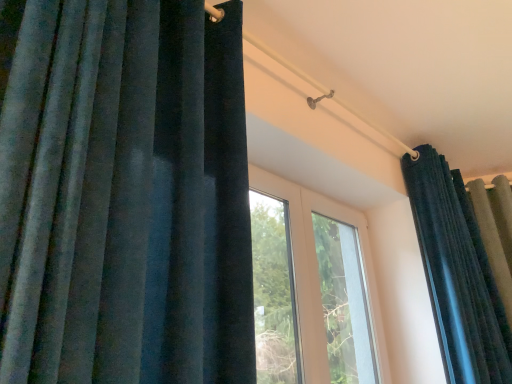
Question: From the image's perspective, is transparent glass window at center beneath velvet dark blue curtain at left, acting as the 1th curtain starting from the front?

Choices:
 (A) no
 (B) yes

Answer: (B)

Question: Is transparent glass window at center smaller than velvet dark blue curtain at left, acting as the 1th curtain starting from the front?

Choices:
 (A) yes
 (B) no

Answer: (A)

Question: Is transparent glass window at center oriented away from velvet dark blue curtain at left, arranged as the 2th curtain when viewed from the back?

Choices:
 (A) yes
 (B) no

Answer: (B)

Question: Can velvet dark blue curtain at left, acting as the 1th curtain starting from the front, be found inside transparent glass window at center?

Choices:
 (A) yes
 (B) no

Answer: (B)

Question: Would you consider transparent glass window at center to be distant from velvet dark blue curtain at left, acting as the 1th curtain starting from the front?

Choices:
 (A) yes
 (B) no

Answer: (A)

Question: Considering the relative positions of transparent glass window at center and velvet dark blue curtain at left, acting as the 1th curtain starting from the front, in the image provided, is transparent glass window at center to the left of velvet dark blue curtain at left, acting as the 1th curtain starting from the front, from the viewer's perspective?

Choices:
 (A) yes
 (B) no

Answer: (B)

Question: Would you say transparent glass window at center contains velvet dark blue curtain at upper right, which appears as the second curtain when viewed from the front?

Choices:
 (A) yes
 (B) no

Answer: (B)

Question: From a real-world perspective, is transparent glass window at center located beneath velvet dark blue curtain at upper right, the first curtain positioned from the back?

Choices:
 (A) yes
 (B) no

Answer: (A)

Question: From a real-world perspective, is transparent glass window at center located higher than velvet dark blue curtain at upper right, positioned as the 2th curtain in left-to-right order?

Choices:
 (A) yes
 (B) no

Answer: (B)

Question: Considering the relative sizes of transparent glass window at center and velvet dark blue curtain at upper right, the first curtain positioned from the back, in the image provided, is transparent glass window at center bigger than velvet dark blue curtain at upper right, the first curtain positioned from the back,?

Choices:
 (A) yes
 (B) no

Answer: (B)

Question: Does transparent glass window at center touch velvet dark blue curtain at upper right, which appears as the first curtain when viewed from the right?

Choices:
 (A) yes
 (B) no

Answer: (B)

Question: Is transparent glass window at center outside velvet dark blue curtain at upper right, positioned as the 2th curtain in left-to-right order?

Choices:
 (A) yes
 (B) no

Answer: (A)

Question: Can you confirm if velvet dark blue curtain at upper right, positioned as the 2th curtain in left-to-right order, is taller than velvet dark blue curtain at left, acting as the 1th curtain starting from the front?

Choices:
 (A) no
 (B) yes

Answer: (B)